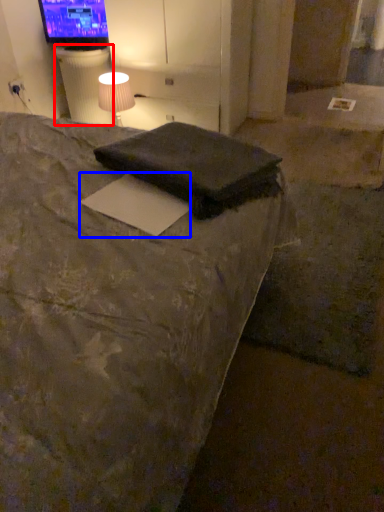
Question: Which object is further to the camera taking this photo, table (highlighted by a red box) or paper (highlighted by a blue box)?

Choices:
 (A) table
 (B) paper

Answer: (A)